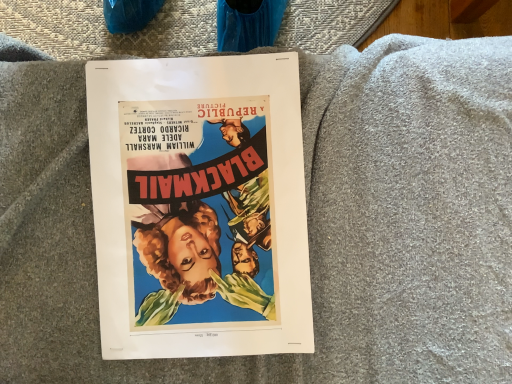
Based on the photo, measure the distance between vibrant paper poster at center and camera.

vibrant paper poster at center and camera are 41.08 centimeters apart.

What do you see at coordinates (199, 206) in the screenshot? The height and width of the screenshot is (384, 512). I see `vibrant paper poster at center` at bounding box center [199, 206].

Image resolution: width=512 pixels, height=384 pixels. Find the location of `vibrant paper poster at center`. vibrant paper poster at center is located at coordinates (199, 206).

In order to face vibrant paper poster at center, should I rotate leftwards or rightwards?

You should rotate left by 7.829 degrees.

Find the location of a particular element. This screenshot has height=384, width=512. vibrant paper poster at center is located at coordinates [199, 206].